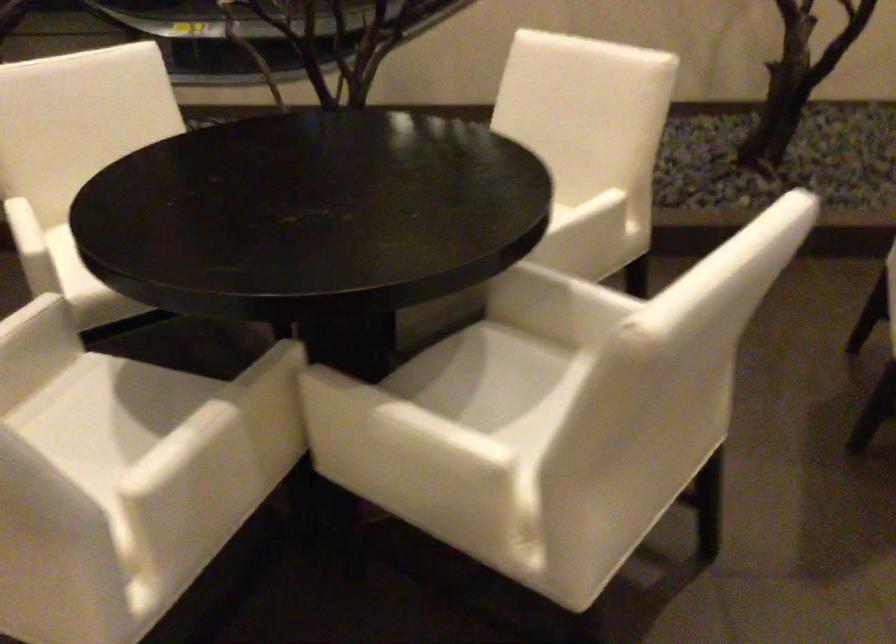
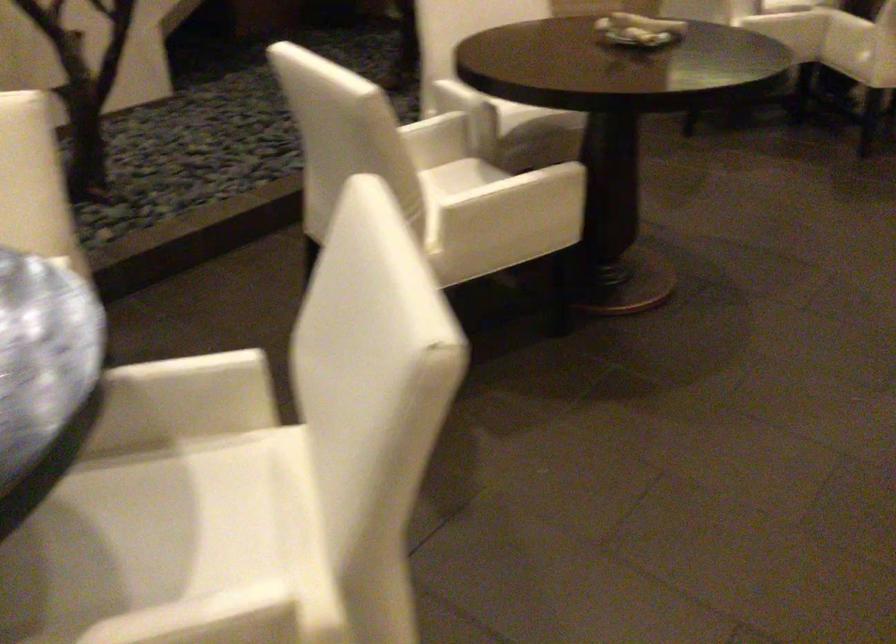
Find the pixel in the second image that matches [532,390] in the first image.

(177, 514)